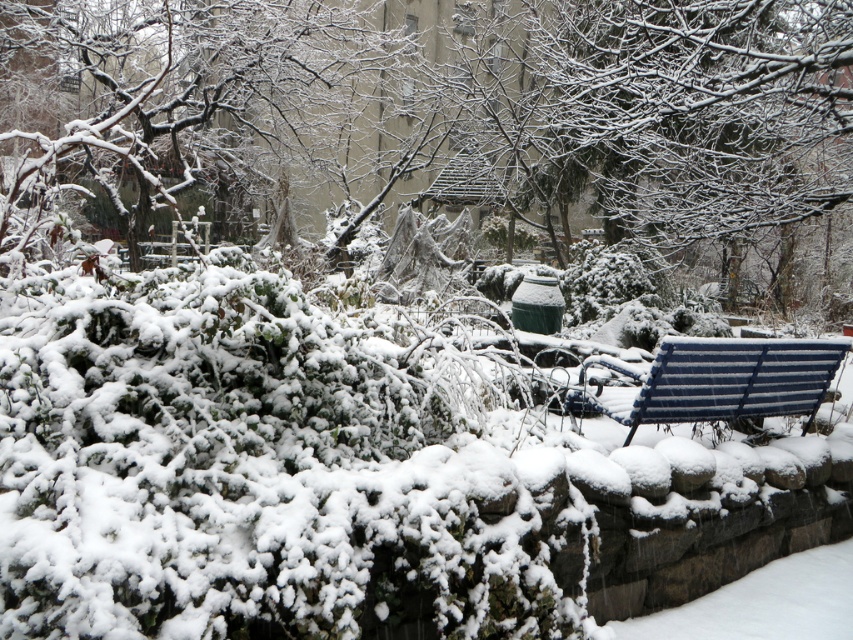
Does snow-covered branches at upper left lie in front of blue striped bench at right?

Yes, it is.

The width and height of the screenshot is (853, 640). I want to click on snow-covered branches at upper left, so click(189, 108).

Where is `snow-covered branches at upper left`? The image size is (853, 640). snow-covered branches at upper left is located at coordinates (189, 108).